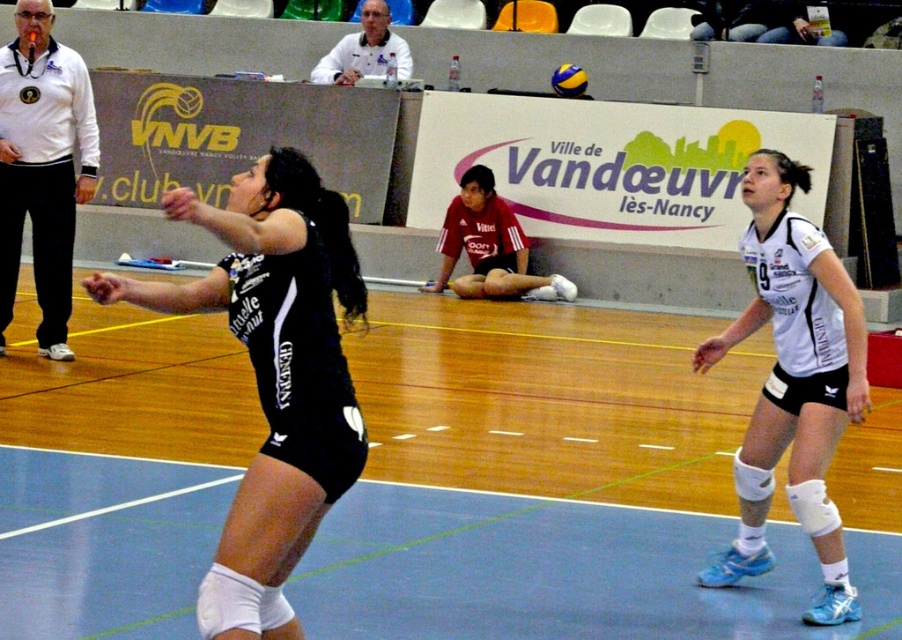
Question: Which object is positioned closest to the white matte knee pads at right?

Choices:
 (A) blue rubber volleyball court at center
 (B) red jersey shorts at center
 (C) black matte uniform at center

Answer: (C)

Question: Which object is positioned farthest from the white matte jacket at left?

Choices:
 (A) black matte uniform at center
 (B) blue rubber volleyball court at center

Answer: (A)

Question: Which object is the farthest from the white matte jacket at left?

Choices:
 (A) black matte uniform at center
 (B) red jersey shorts at center
 (C) white matte knee pads at right
 (D) yellow matte volleyball at center

Answer: (D)

Question: Does white matte knee pads at right appear on the left side of red jersey shorts at center?

Choices:
 (A) yes
 (B) no

Answer: (B)

Question: Considering the relative positions of blue rubber volleyball court at center and black matte uniform at center in the image provided, where is blue rubber volleyball court at center located with respect to black matte uniform at center?

Choices:
 (A) left
 (B) right

Answer: (A)

Question: Does white matte knee pads at right have a lesser width compared to red jersey shorts at center?

Choices:
 (A) no
 (B) yes

Answer: (B)